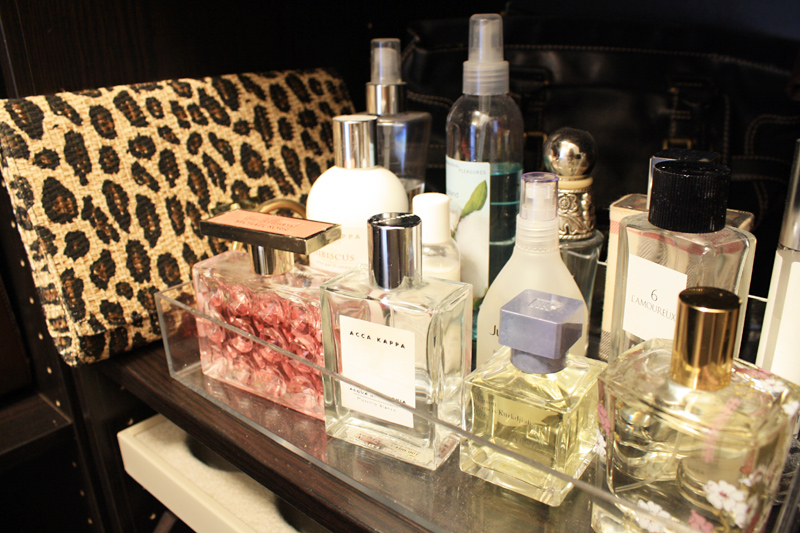
Where is `tallest perfume bottle`? The image size is (800, 533). tallest perfume bottle is located at coordinates pyautogui.click(x=494, y=120).